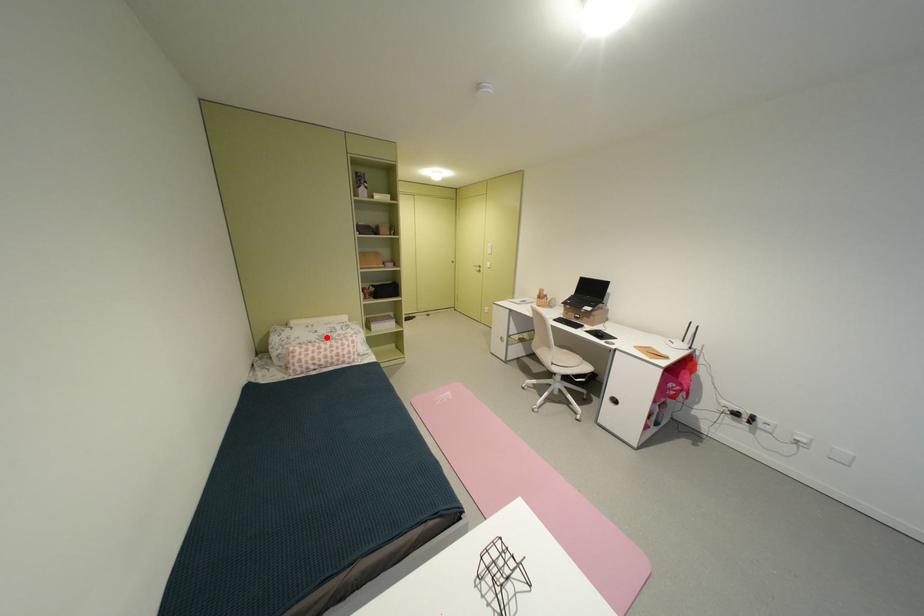
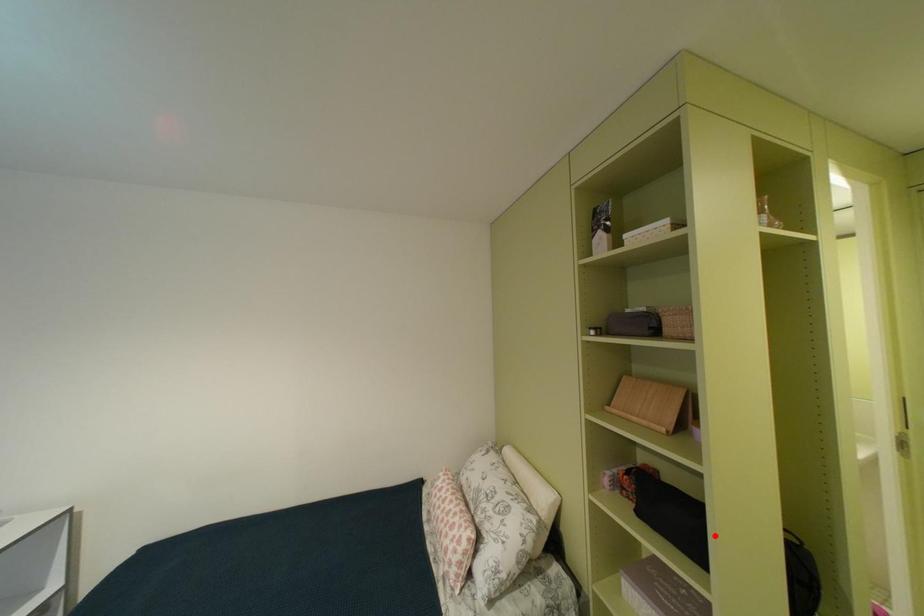
I am providing you with two images of the same scene from different viewpoints. A red point is marked on the first image and another point is marked on the second image. Does the point marked in image1 correspond to the same location as the one in image2?

No